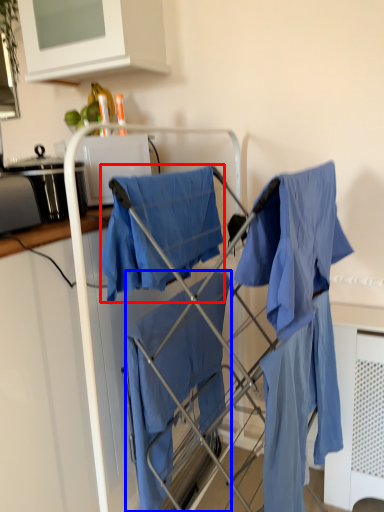
Question: Among these objects, which one is nearest to the camera, cloak (highlighted by a red box) or cloak (highlighted by a blue box)?

Choices:
 (A) cloak
 (B) cloak

Answer: (A)